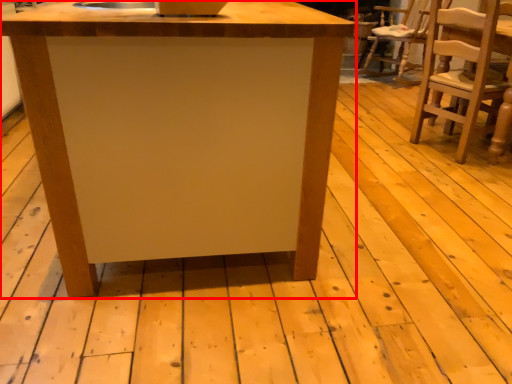
Question: Observing the image, what is the correct spatial positioning of table (annotated by the red box) in reference to chair?

Choices:
 (A) left
 (B) right

Answer: (A)